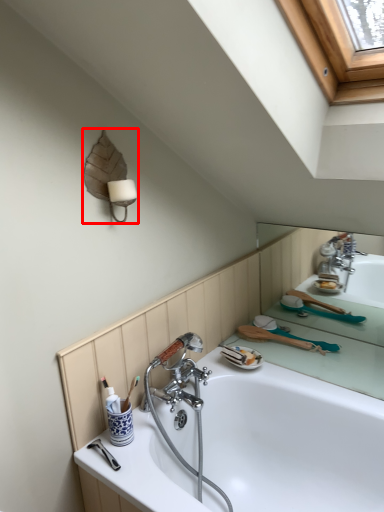
Question: Observing the image, what is the correct spatial positioning of lamp (annotated by the red box) in reference to bathtub?

Choices:
 (A) left
 (B) right

Answer: (A)